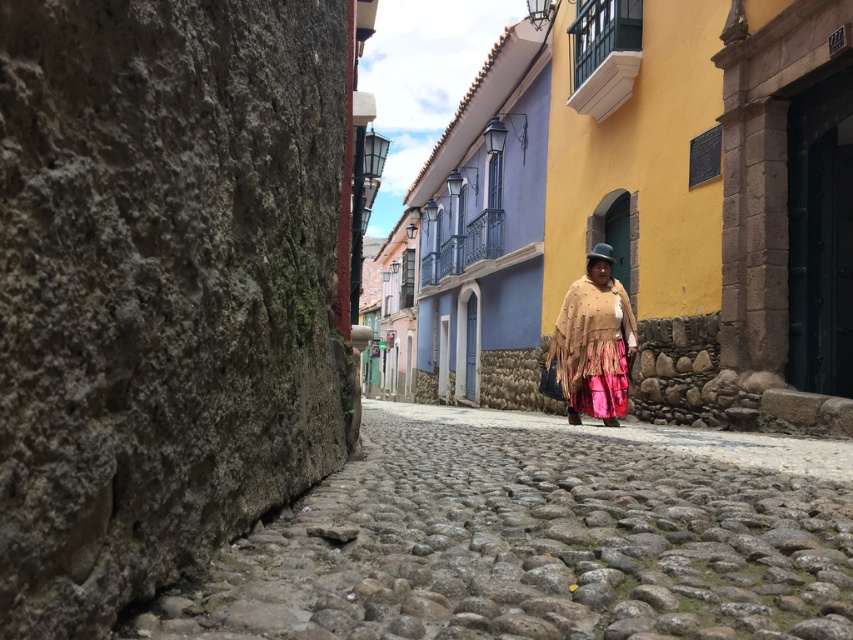
Does gray cobblestone path at center appear over beige fringed poncho at center?

No.

Is gray cobblestone path at center shorter than beige fringed poncho at center?

Correct, gray cobblestone path at center is not as tall as beige fringed poncho at center.

Is point (605, 474) positioned in front of point (589, 388)?

Yes, point (605, 474) is closer to viewer.

Where is `gray cobblestone path at center`? Image resolution: width=853 pixels, height=640 pixels. gray cobblestone path at center is located at coordinates click(x=540, y=538).

Looking at this image, is cobblestone street at center above beige fringed poncho at center?

Incorrect, cobblestone street at center is not positioned above beige fringed poncho at center.

Does point (729, 461) lie in front of point (577, 364)?

That is True.

Between point (647, 426) and point (625, 321), which one is positioned in front?

Positioned in front is point (625, 321).

The width and height of the screenshot is (853, 640). What are the coordinates of `cobblestone street at center` in the screenshot? It's located at (656, 436).

Who is positioned more to the left, gray cobblestone path at center or cobblestone street at center?

cobblestone street at center is more to the left.

Is gray cobblestone path at center above cobblestone street at center?

Correct, gray cobblestone path at center is located above cobblestone street at center.

You are a GUI agent. You are given a task and a screenshot of the screen. Output one action in this format:
    pyautogui.click(x=<x>, y=<y>)
    Task: Click on the gray cobblestone path at center
    
    Given the screenshot: What is the action you would take?
    pyautogui.click(x=540, y=538)